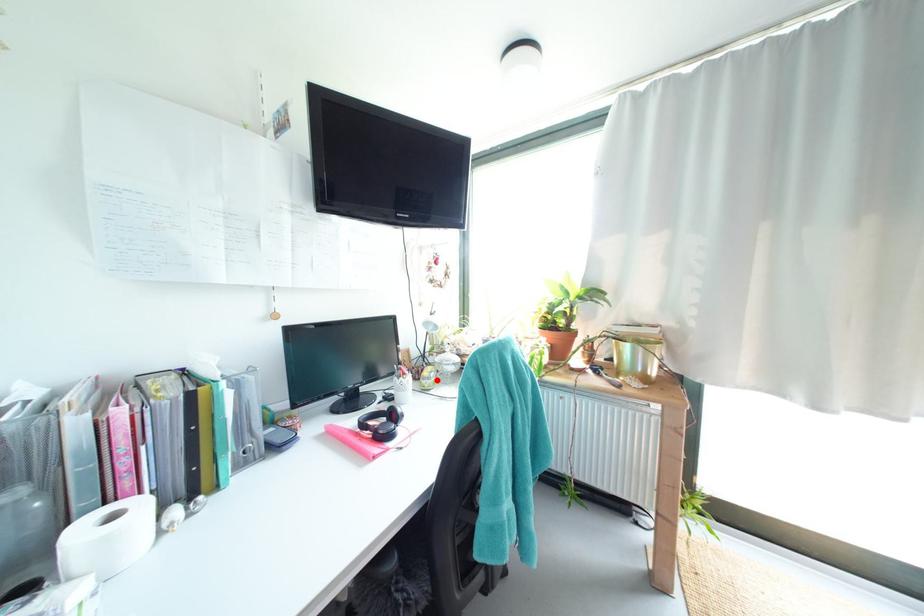
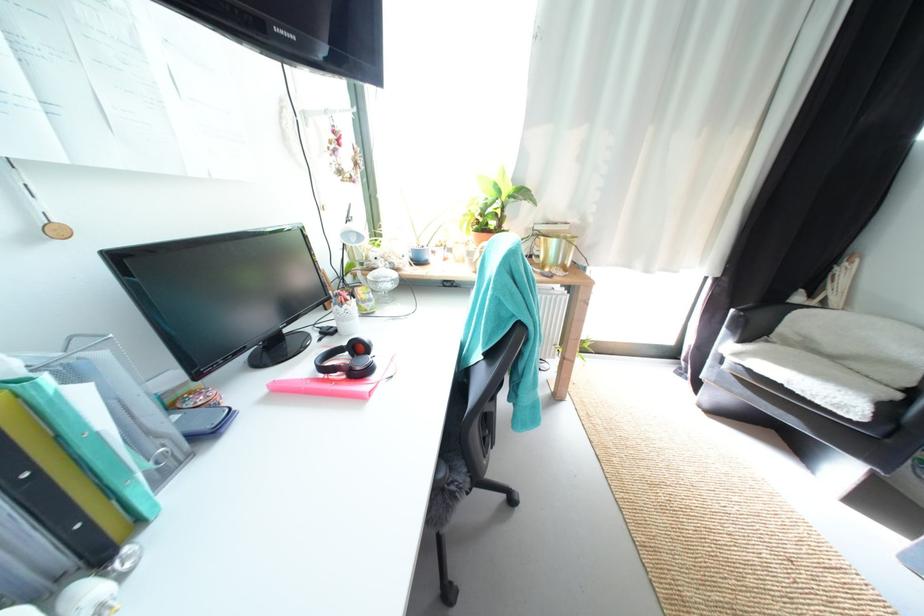
Where in the second image is the point corresponding to the highlighted location from the first image?

(378, 302)